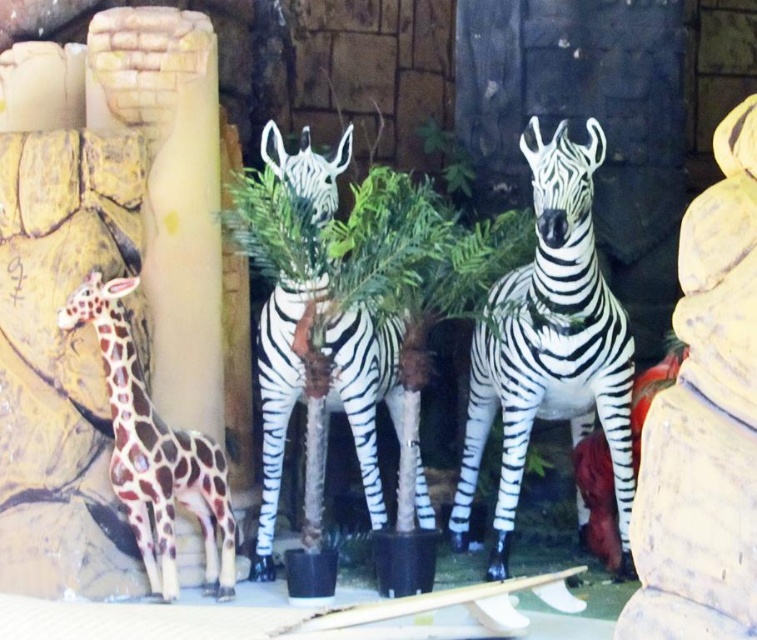
You are standing in the exhibit and want to take a photo of the zebras. The camera you have can focus on objects up to 6 meters away. Is the point at coordinates point (534, 180) within the camera focus range?

The distance of point (534, 180) from the camera is 6.52 meters, which exceeds the camera focus limit of 6 meters. Therefore, the point is out of focus range.

You are a visitor at the exhibit and want to take a photo of both the white glossy zebra at center and the shiny brown giraffe at left. Since you want to capture both in the same frame, which one should you focus on first to ensure both are in focus?

You should focus on the white glossy zebra at center first because it is closer to you than the shiny brown giraffe at left, so adjusting focus from near to far will help both be in focus.

You are a visitor at the exhibit and want to take a photo of both the white glossy zebra at center and the shiny brown giraffe at left. Which one should you stand closer to in order to capture both in the same frame?

You should stand closer to the shiny brown giraffe at left because the white glossy zebra at center is positioned on the right side of it, so placing yourself near the giraffe will allow both to be included in the photo.